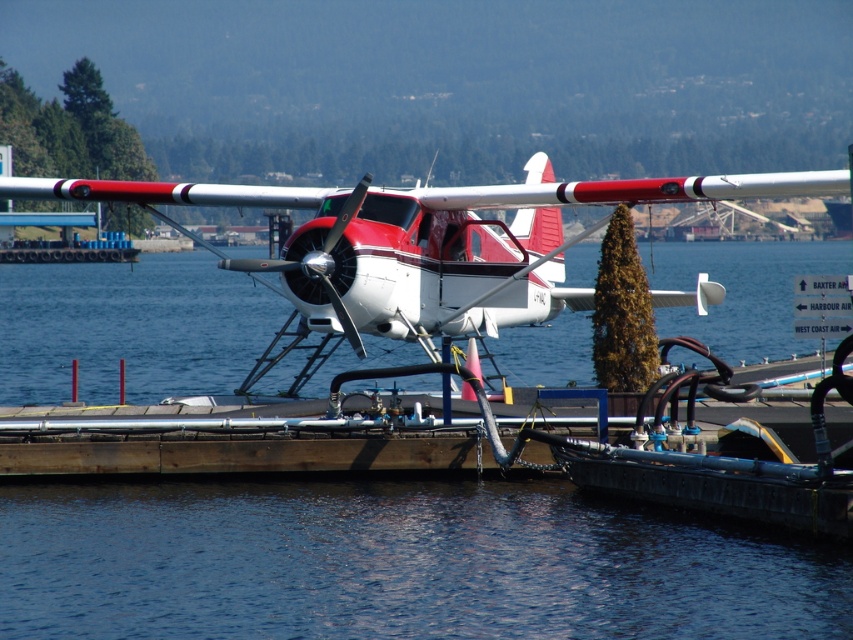
Question: Does blue liquid water at lower center have a greater width compared to matte white airplane at center?

Choices:
 (A) yes
 (B) no

Answer: (B)

Question: Which of the following is the closest to the observer?

Choices:
 (A) (442, 266)
 (B) (260, 524)

Answer: (B)

Question: Does blue liquid water at lower center appear under matte white airplane at center?

Choices:
 (A) yes
 (B) no

Answer: (A)

Question: Among these objects, which one is nearest to the camera?

Choices:
 (A) matte white airplane at center
 (B) blue liquid water at lower center

Answer: (B)

Question: Is blue liquid water at lower center thinner than matte white airplane at center?

Choices:
 (A) no
 (B) yes

Answer: (B)